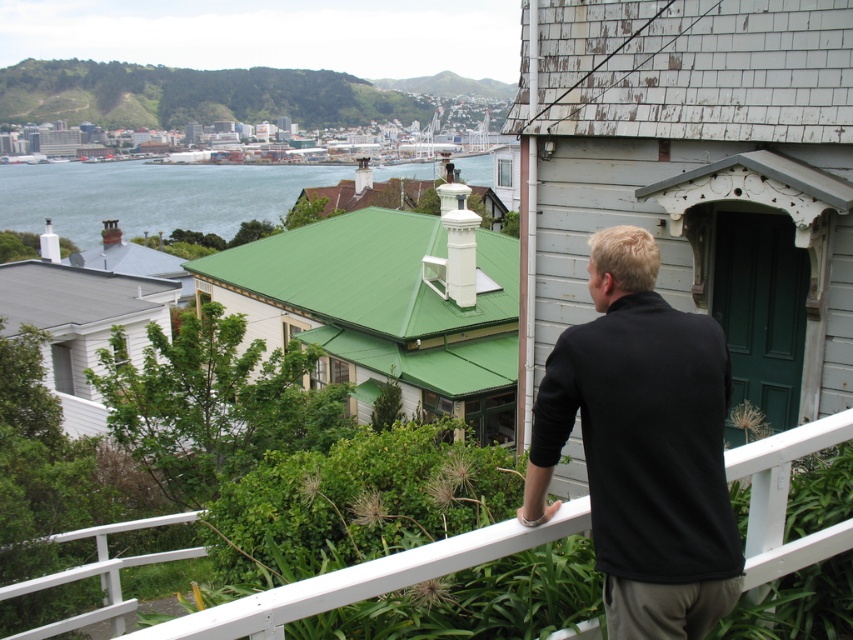
Can you confirm if white painted wood at upper center is smaller than green water at upper left?

Yes.

Between point (334, 605) and point (154, 193), which one is positioned in front?

Point (334, 605) is in front.

I want to click on white painted wood at upper center, so click(x=364, y=579).

Between black matte shirt at upper right and green water at upper left, which one is positioned higher?

Positioned higher is green water at upper left.

Find the location of a particular element. black matte shirt at upper right is located at coordinates (643, 445).

Which is behind, point (705, 493) or point (80, 576)?

Positioned behind is point (80, 576).

Locate an element on the screen. The width and height of the screenshot is (853, 640). black matte shirt at upper right is located at coordinates (643, 445).